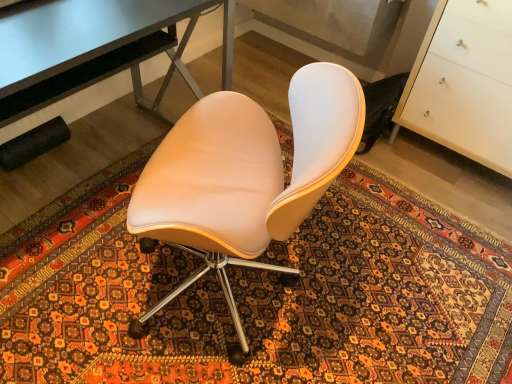
Question: Considering the positions of white glossy cabinet at right and patterned carpet at center in the image, is white glossy cabinet at right bigger or smaller than patterned carpet at center?

Choices:
 (A) small
 (B) big

Answer: (B)

Question: Is white glossy cabinet at right in front of or behind patterned carpet at center in the image?

Choices:
 (A) front
 (B) behind

Answer: (B)

Question: Which of these objects is positioned closest to the matte beige chair at center?

Choices:
 (A) patterned carpet at center
 (B) metallic gray desk at upper left
 (C) white glossy cabinet at right

Answer: (B)

Question: Which is farther from the metallic gray desk at upper left?

Choices:
 (A) patterned carpet at center
 (B) white glossy cabinet at right
 (C) matte beige chair at center

Answer: (B)